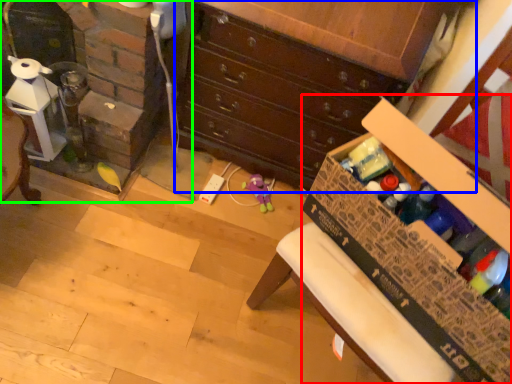
Question: Estimate the real-world distances between objects in this image. Which object is closer to cardboard box (highlighted by a red box), chest of drawers (highlighted by a blue box) or fireplace (highlighted by a green box)?

Choices:
 (A) chest of drawers
 (B) fireplace

Answer: (A)